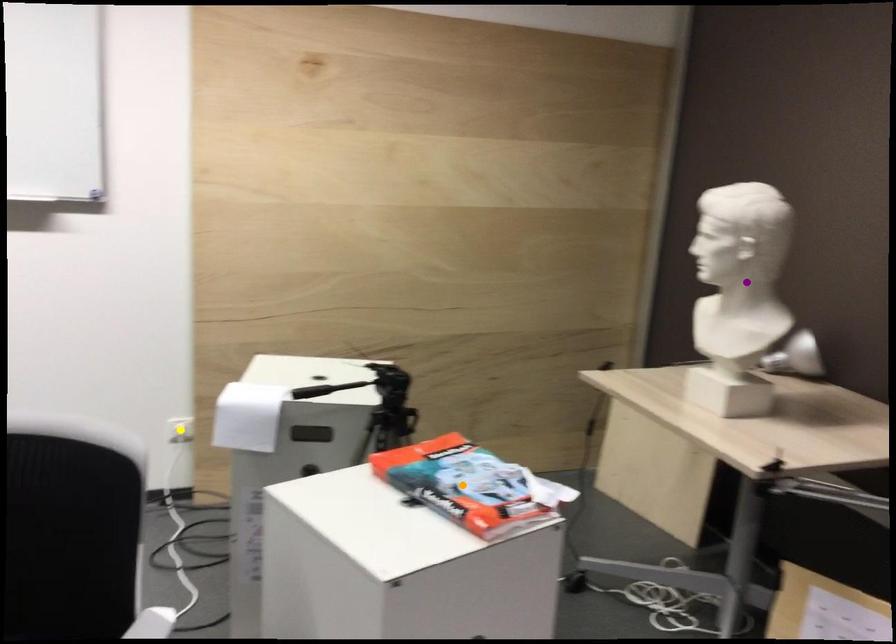
Order these from nearest to farthest:
- purple point
- yellow point
- orange point

orange point, purple point, yellow point